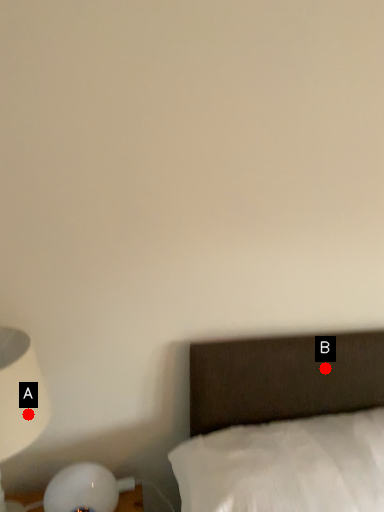
Question: Two points are circled on the image, labeled by A and B beside each circle. Which point is closer to the camera?

Choices:
 (A) A is closer
 (B) B is closer

Answer: (A)